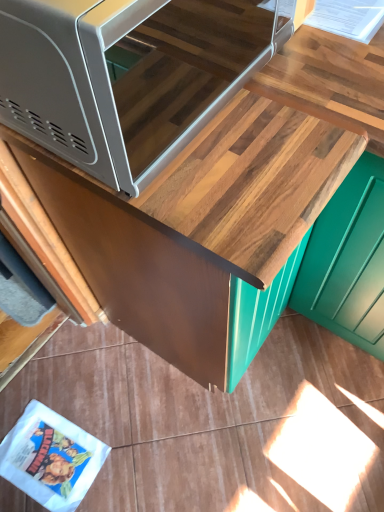
Question: Would you say wooden cabinet at upper center is to the left or to the right of matte gray microwave at upper left in the picture?

Choices:
 (A) left
 (B) right

Answer: (B)

Question: From the image's perspective, is wooden cabinet at upper center above or below matte gray microwave at upper left?

Choices:
 (A) above
 (B) below

Answer: (B)

Question: Considering the positions of point (201, 184) and point (220, 106), is point (201, 184) closer or farther from the camera than point (220, 106)?

Choices:
 (A) farther
 (B) closer

Answer: (B)

Question: Looking at their shapes, would you say matte gray microwave at upper left is wider or thinner than wooden cabinet at upper center?

Choices:
 (A) wide
 (B) thin

Answer: (B)

Question: Does point [92, 78] appear closer or farther from the camera than point [294, 262]?

Choices:
 (A) closer
 (B) farther

Answer: (A)

Question: From the image's perspective, is matte gray microwave at upper left located above or below wooden cabinet at upper center?

Choices:
 (A) below
 (B) above

Answer: (B)

Question: From a real-world perspective, is matte gray microwave at upper left physically located above or below wooden cabinet at upper center?

Choices:
 (A) below
 (B) above

Answer: (B)